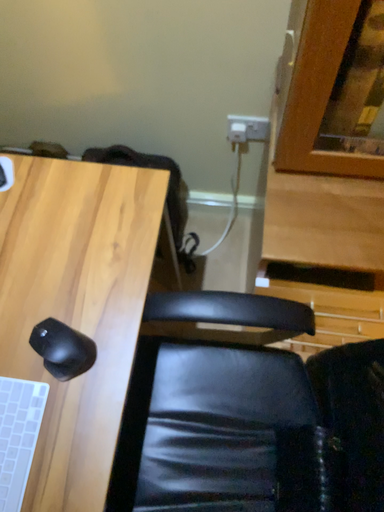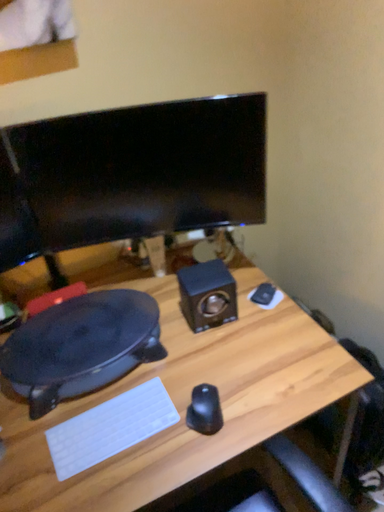
Question: Which way did the camera rotate in the video?

Choices:
 (A) rotated right
 (B) rotated left

Answer: (B)